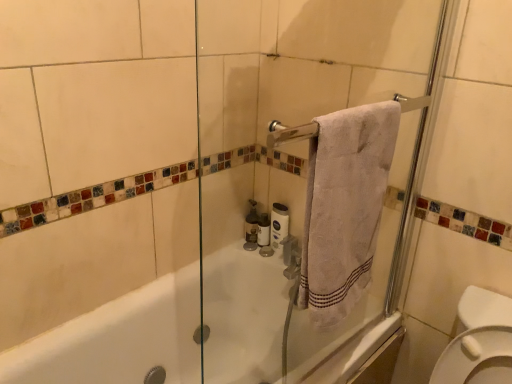
Question: Looking at the image, does matte glass soap dispenser at center seem bigger or smaller compared to white matte toilet paper at center, which ranks as the first toilet paper in left-to-right order?

Choices:
 (A) big
 (B) small

Answer: (A)

Question: From a real-world perspective, relative to white matte toilet paper at center, which ranks as the first toilet paper in left-to-right order, is matte glass soap dispenser at center vertically above or below?

Choices:
 (A) below
 (B) above

Answer: (B)

Question: Which is nearer to the white matte toilet paper at center, which is the first toilet paper in right-to-left order?

Choices:
 (A) transparent glass screen door at center
 (B) white matte toilet paper at center, marked as the second toilet paper in a right-to-left arrangement
 (C) matte glass soap dispenser at center
 (D) white cotton towel at upper right

Answer: (B)

Question: Which object is positioned farthest from the transparent glass screen door at center?

Choices:
 (A) white matte toilet paper at center, marked as the second toilet paper in a right-to-left arrangement
 (B) white cotton towel at upper right
 (C) matte glass soap dispenser at center
 (D) white matte toilet paper at center, the 2th toilet paper positioned from the left

Answer: (D)